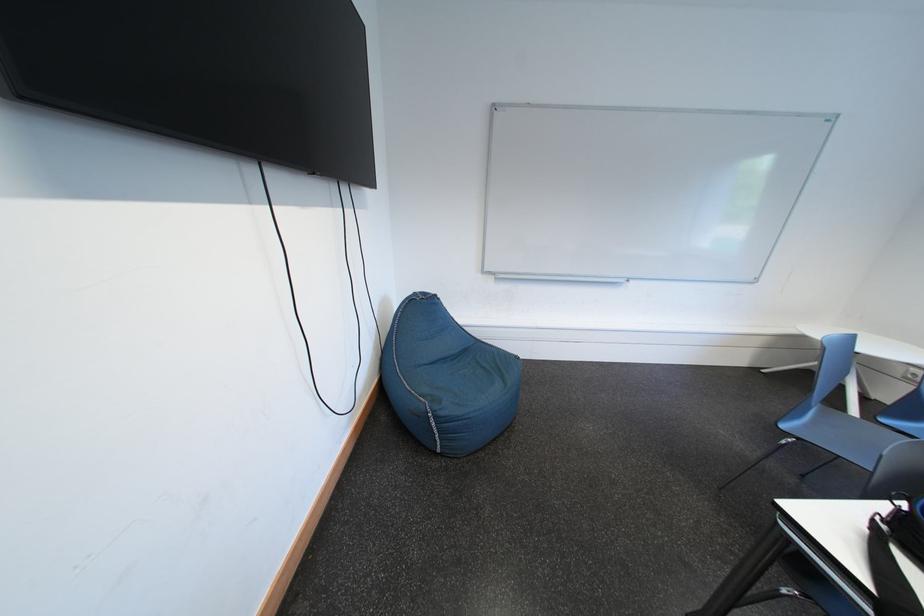
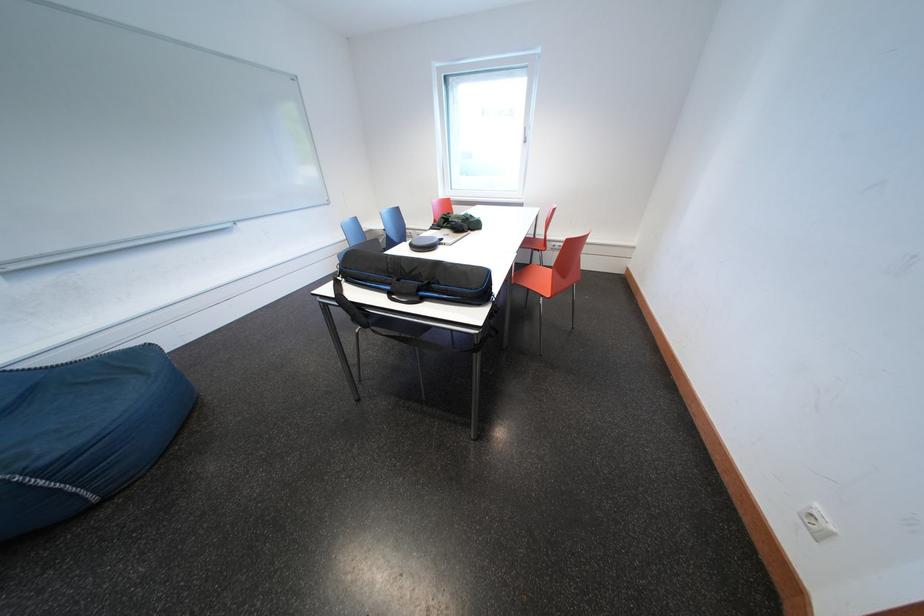
The images are taken continuously from a first-person perspective. In which direction is your viewpoint rotating?

The camera's rotation is toward right-down.